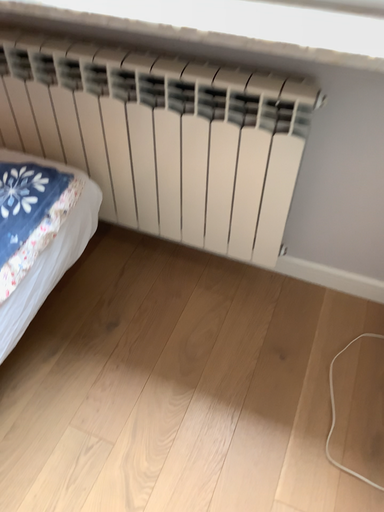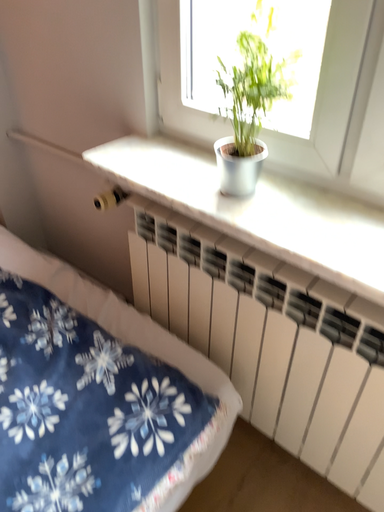
Question: Which way did the camera rotate in the video?

Choices:
 (A) rotated left
 (B) rotated right

Answer: (A)